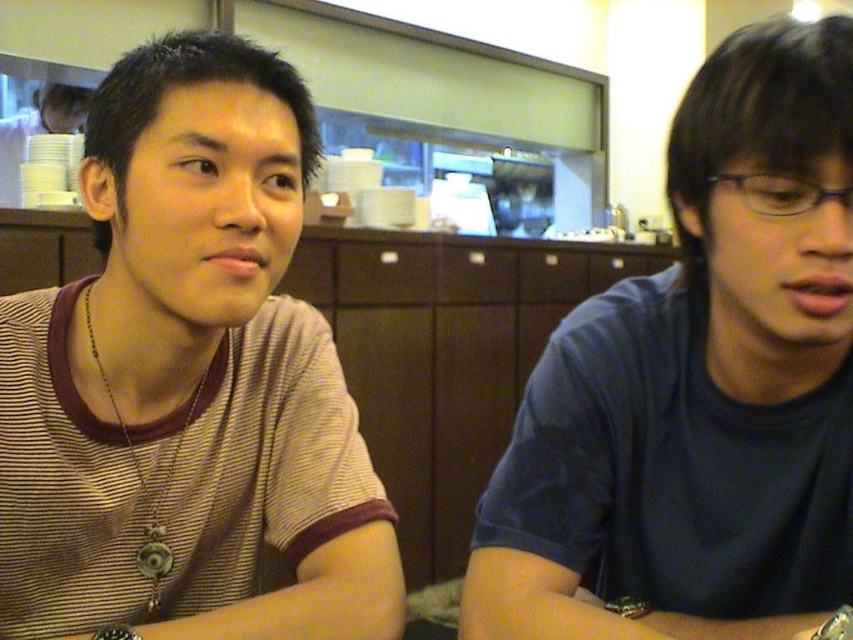
Does point (277, 493) lie behind point (833, 164)?

Yes.

Locate an element on the screen. The image size is (853, 640). brown striped shirt at left is located at coordinates (187, 381).